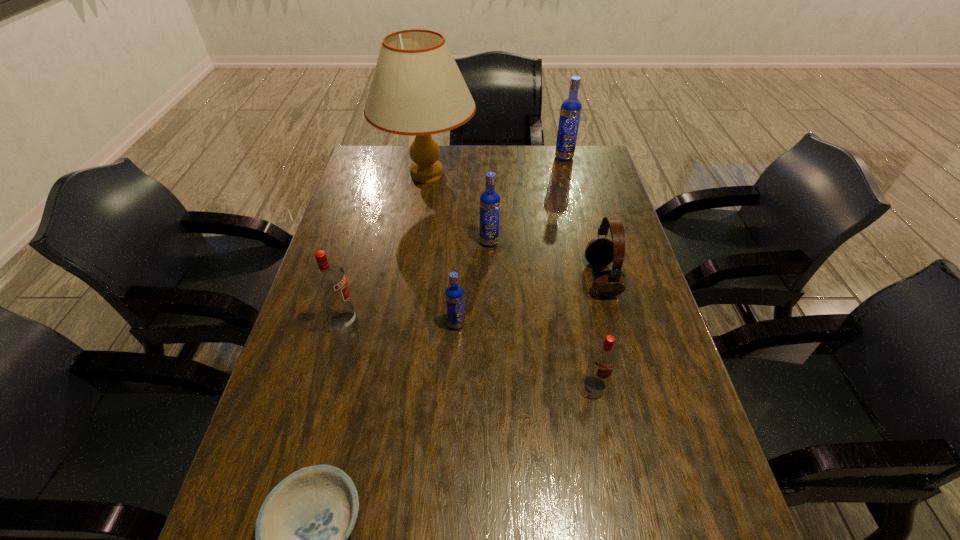
The width and height of the screenshot is (960, 540). Identify the location of blue vodka identified as the second closest to the tallest vodka. (454, 293).

Locate an element on the screen. This screenshot has height=540, width=960. free spot that satisfies the following two spatial constraints: 1. on the back side of the leftmost blue vodka; 2. on the right side of the farthest blue vodka is located at coordinates (465, 157).

Where is `vacant space that satisfies the following two spatial constraints: 1. on the back side of the seventh shortest object; 2. on the right side of the fourth vodka from right to left`? This screenshot has width=960, height=540. vacant space that satisfies the following two spatial constraints: 1. on the back side of the seventh shortest object; 2. on the right side of the fourth vodka from right to left is located at coordinates (465, 157).